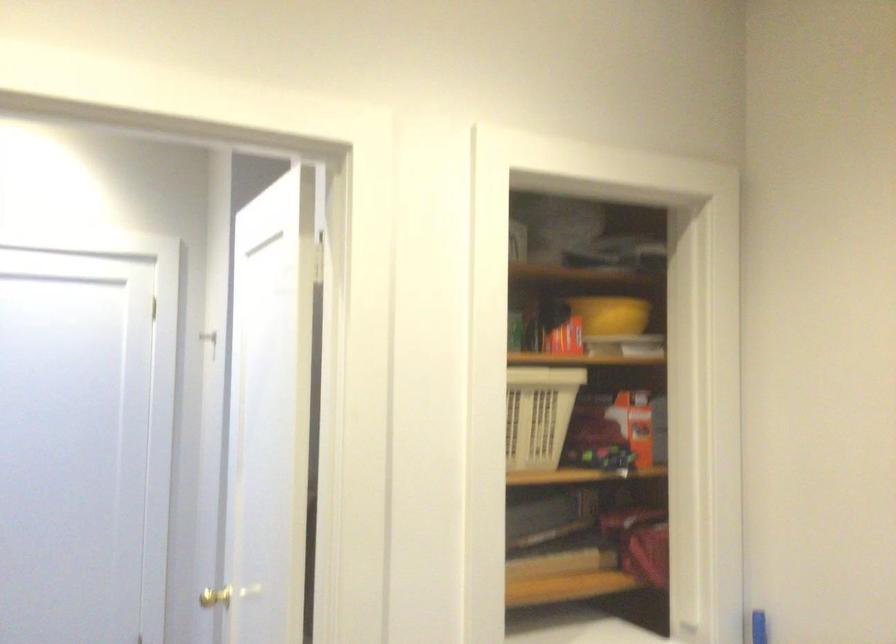
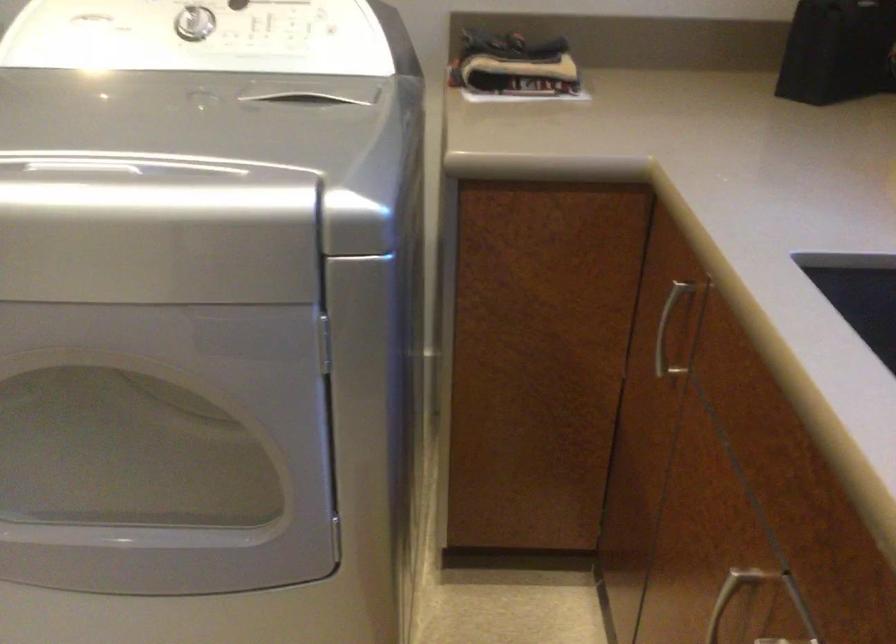
Consider the image. First-person continuous shooting, in which direction is the camera rotating?

The camera's rotation is toward right-down.